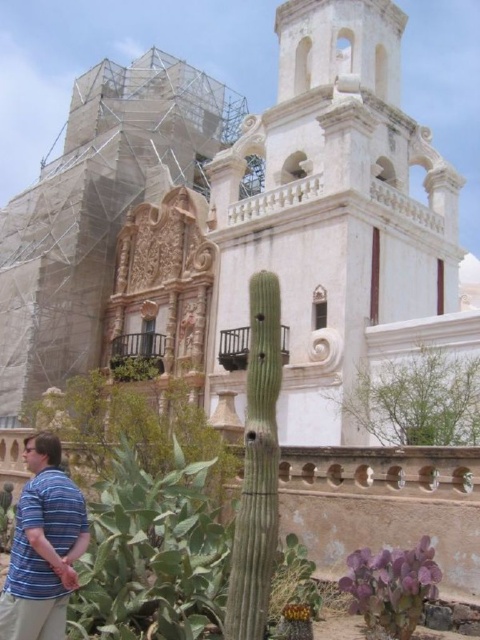
You are a painter standing near the scaffolding on the historic building. You notice a blue striped shirt at lower left and a green leafy bush at center in your view. Which object is taller in the scene?

The blue striped shirt at lower left is taller than the green leafy bush at center according to the description.

You are a gardener who needs to water both the green leafy plant at upper center and the green leafy bush at center. Which one requires more water based on their sizes?

The green leafy plant at upper center has a larger size compared to the green leafy bush at center, so it likely requires more water.

You are a construction worker standing on the scaffolding near the point marked at coordinates [417,400]. You need to place a new decorative element on the building facade. The element requires a spot that is both elevated and has a clear view of the main entrance. Is the current location suitable?

The point marked at coordinates [417,400] indicates the green leafy plant at upper center. Since this location is at the upper center of the building, it is elevated and likely provides a clear view of the main entrance, making it a suitable spot for placing the decorative element.